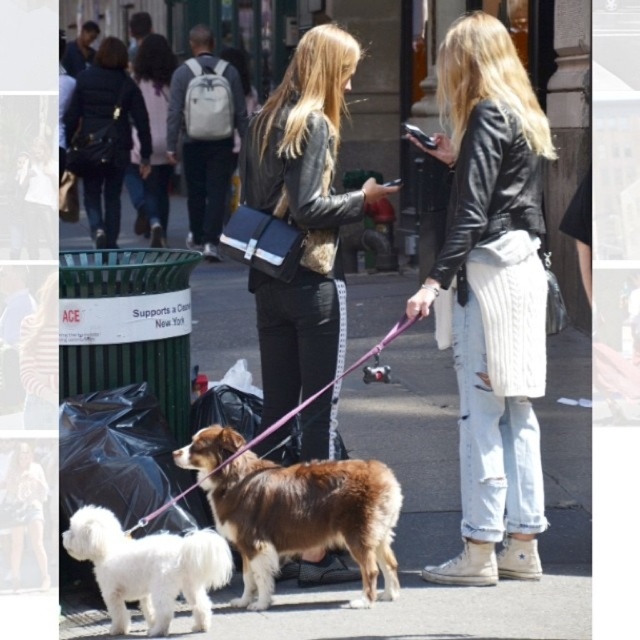
Question: Where is leather jacket at center located in relation to purple fabric leash at center in the image?

Choices:
 (A) right
 (B) left

Answer: (A)

Question: Is black leather jacket at center below black quilted jacket at upper left?

Choices:
 (A) yes
 (B) no

Answer: (A)

Question: Does black leather jacket at center appear under brown furry dog at center?

Choices:
 (A) yes
 (B) no

Answer: (B)

Question: Which point is closer to the camera?

Choices:
 (A) (314, 316)
 (B) (538, 380)
 (C) (116, 236)

Answer: (B)

Question: Which of the following is the farthest from the observer?

Choices:
 (A) brown furry dog at center
 (B) smooth asphalt pavement at center

Answer: (A)

Question: Which object is positioned farthest from the purple fabric leash at center?

Choices:
 (A) white fluffy dog at lower left
 (B) matte gray backpack at upper left
 (C) black quilted jacket at upper left

Answer: (B)